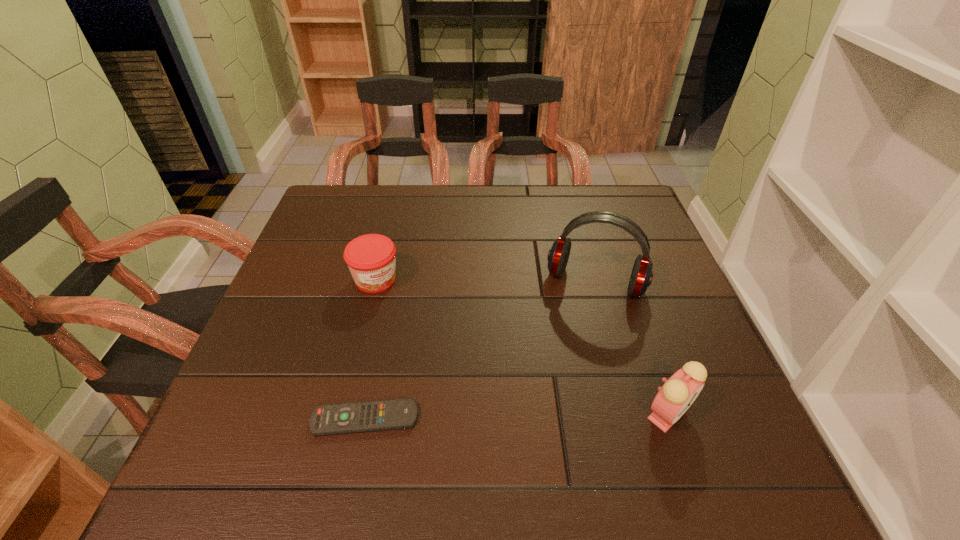
What are the coordinates of `the shortest object` in the screenshot? It's located at [357, 417].

This screenshot has height=540, width=960. What are the coordinates of `the second tallest object` in the screenshot? It's located at (673, 399).

In order to click on earphone in this screenshot , I will do `click(641, 277)`.

Find the location of a particular element. the second shortest object is located at coordinates (371, 258).

This screenshot has height=540, width=960. In order to click on free space located 0.290m on the back of the shortest object in this screenshot , I will do `click(392, 293)`.

Where is `vacant space located on the ear cups of the tallest object`? This screenshot has height=540, width=960. vacant space located on the ear cups of the tallest object is located at coordinates (566, 354).

What are the coordinates of `free space located on the ear cups of the tallest object` in the screenshot? It's located at (555, 390).

At what (x,y) coordinates should I click in order to perform the action: click on free space located 0.320m on the ear cups of the tallest object. Please return your answer as a coordinate pair (x, y). The image size is (960, 540). Looking at the image, I should click on (543, 426).

Where is `vacant space situated on the label side of the third tallest object`? vacant space situated on the label side of the third tallest object is located at coordinates (456, 368).

You are a GUI agent. You are given a task and a screenshot of the screen. Output one action in this format:
    pyautogui.click(x=<x>, y=<y>)
    Task: Click on the free location located on the label side of the third tallest object
    Image resolution: width=960 pixels, height=540 pixels.
    Given the screenshot: What is the action you would take?
    pyautogui.click(x=406, y=313)